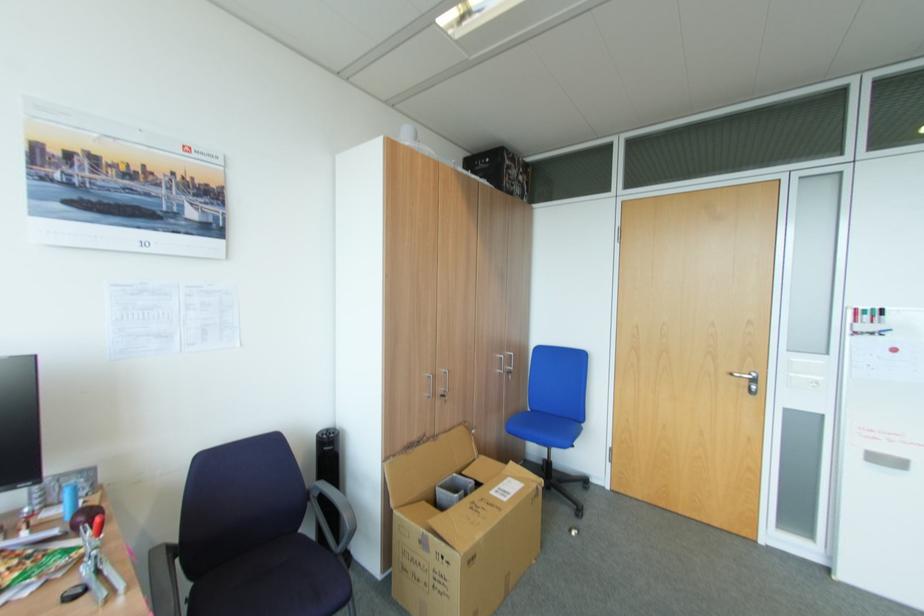
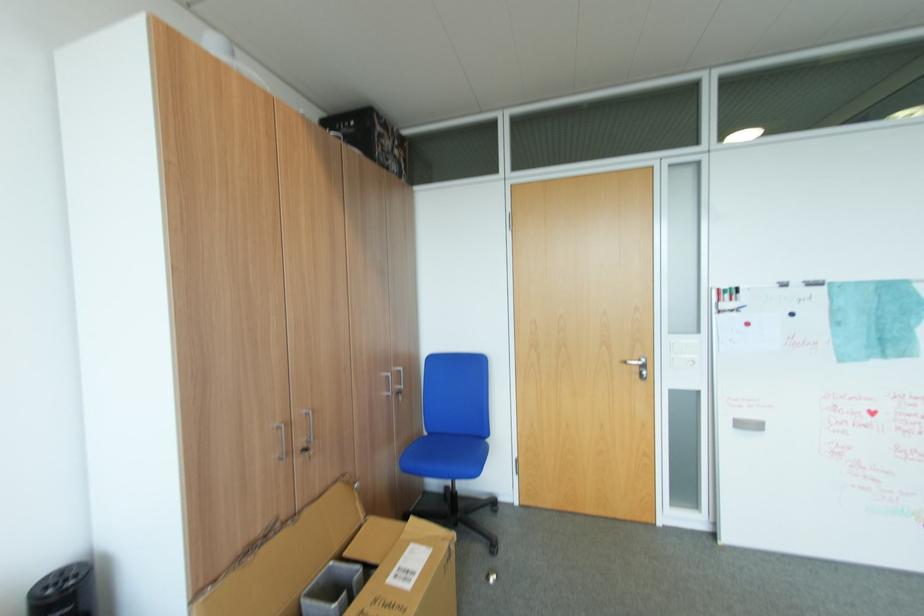
In the second image, find the point that corresponds to [448,395] in the first image.

(310, 451)